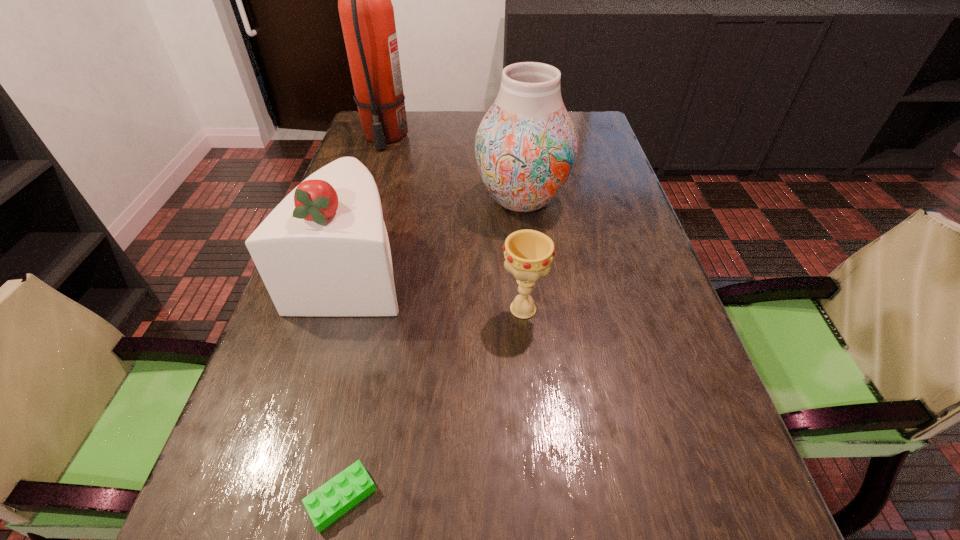
Locate an element on the screen. This screenshot has height=540, width=960. fire extinguisher is located at coordinates (366, 12).

Where is `the tallest object`? the tallest object is located at coordinates (366, 12).

Find the location of a particular element. This screenshot has width=960, height=540. vase is located at coordinates (526, 145).

You are a GUI agent. You are given a task and a screenshot of the screen. Output one action in this format:
    pyautogui.click(x=<x>, y=<y>)
    Task: Click on the cake
    This screenshot has height=540, width=960.
    Given the screenshot: What is the action you would take?
    pyautogui.click(x=324, y=251)

Where is `chalice`? Image resolution: width=960 pixels, height=540 pixels. chalice is located at coordinates (528, 254).

Identify the location of the nearest object. (330, 501).

Identify the location of Lego. The width and height of the screenshot is (960, 540). (330, 501).

Find the location of `free location located on the nozzle of the fire extinguisher`. free location located on the nozzle of the fire extinguisher is located at coordinates (363, 205).

Identify the location of free space located 0.050m on the front of the vase. (526, 242).

Find the location of a particular element. free space located on the right of the cake is located at coordinates tap(569, 268).